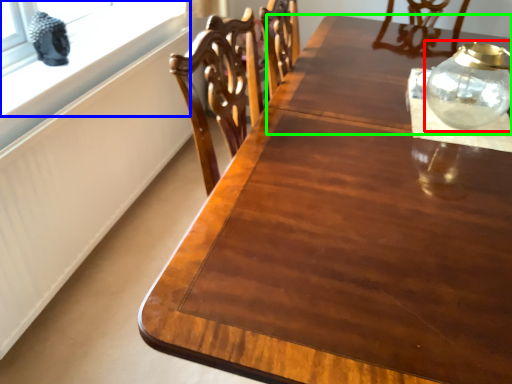
Question: Which is farther away from glass vase (highlighted by a red box)? window (highlighted by a blue box) or round table (highlighted by a green box)?

Choices:
 (A) window
 (B) round table

Answer: (A)